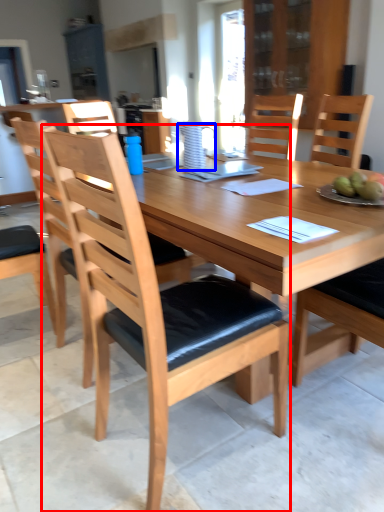
Question: Which of the following is the closest to the observer, chair (highlighted by a red box) or pitcher (highlighted by a blue box)?

Choices:
 (A) chair
 (B) pitcher

Answer: (A)